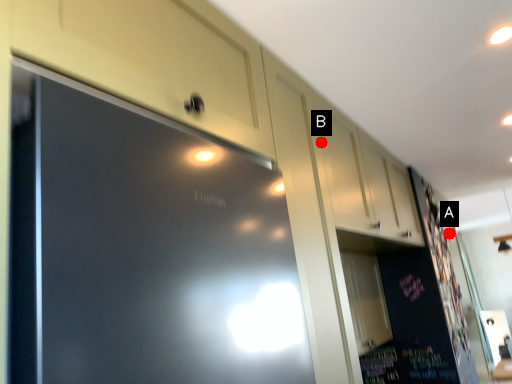
Question: Two points are circled on the image, labeled by A and B beside each circle. Which point appears farthest from the camera in this image?

Choices:
 (A) A is further
 (B) B is further

Answer: (A)